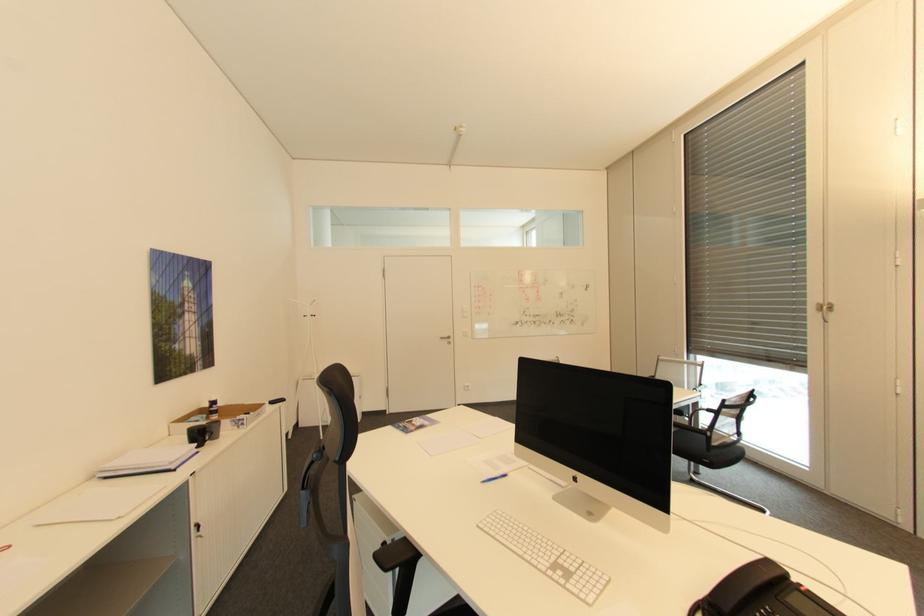
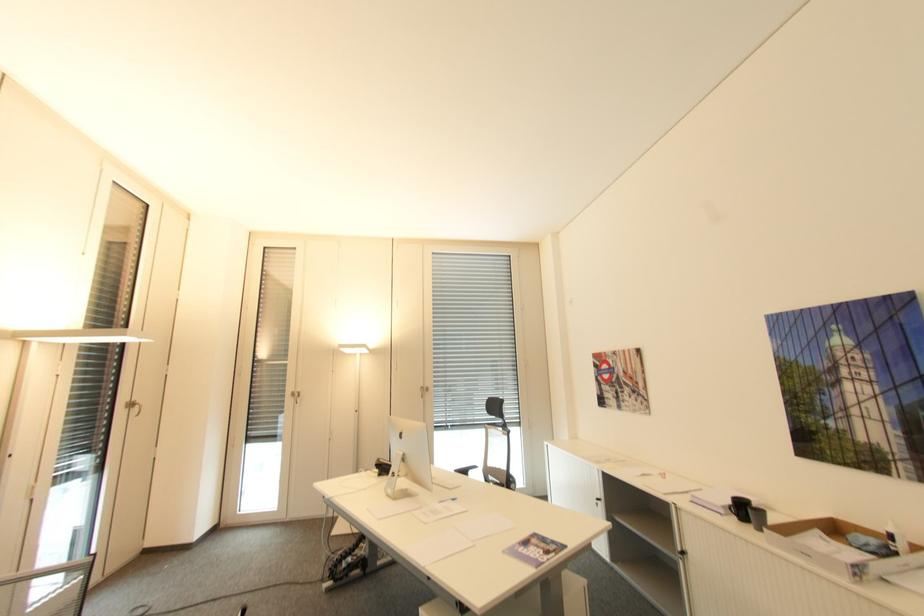
Locate, in the second image, the point that corresponds to (444,422) in the first image.

(507, 553)